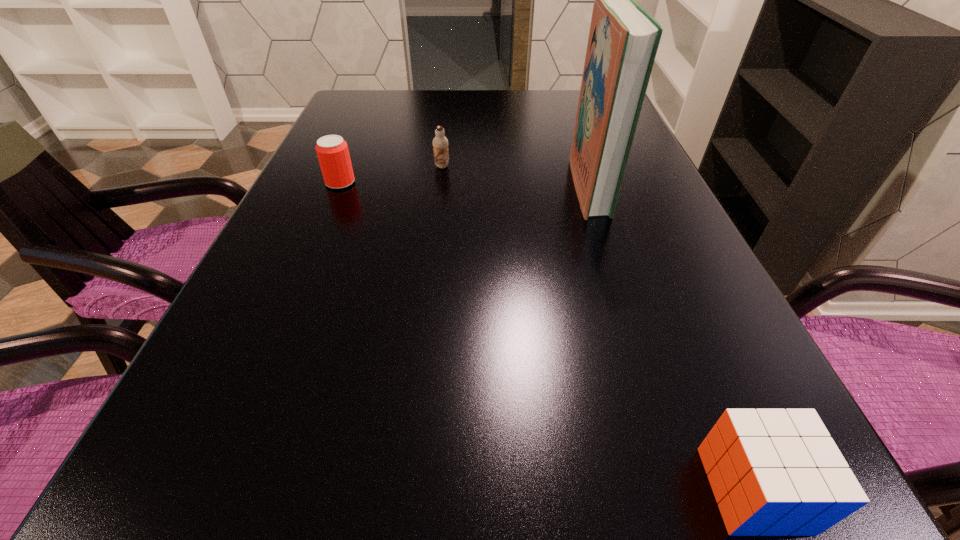
What are the coordinates of `object at the near edge` in the screenshot? It's located at (774, 472).

Identify the location of object situated at the left edge. (332, 151).

Locate an element on the screen. hardback book that is at the right edge is located at coordinates (623, 41).

The width and height of the screenshot is (960, 540). I want to click on cube that is positioned at the right edge, so click(x=774, y=472).

At what (x,y) coordinates should I click in order to perform the action: click on object that is positioned at the near right corner. Please return your answer as a coordinate pair (x, y). Looking at the image, I should click on (774, 472).

The image size is (960, 540). I want to click on vacant space at the far edge of the desktop, so click(405, 121).

Find the location of a particular element. This screenshot has height=540, width=960. free space at the near edge of the desktop is located at coordinates (642, 494).

Find the location of a particular element. This screenshot has height=540, width=960. free spot at the left edge of the desktop is located at coordinates (346, 127).

Image resolution: width=960 pixels, height=540 pixels. In the image, there is a desktop. Identify the location of vacant space at the right edge. (655, 169).

Locate an element on the screen. This screenshot has width=960, height=540. unoccupied area between the leftmost object and the nearest object is located at coordinates (547, 336).